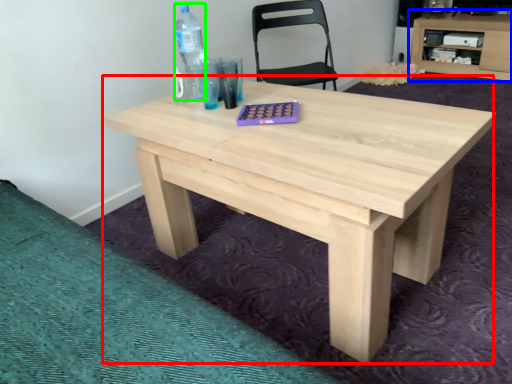
Question: Which object is positioned closest to table (highlighted by a red box)? Select from computer desk (highlighted by a blue box) and bottle (highlighted by a green box).

Choices:
 (A) computer desk
 (B) bottle

Answer: (B)